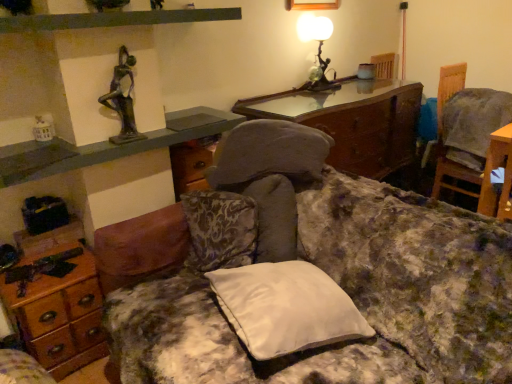
The height and width of the screenshot is (384, 512). I want to click on free location to the left of bronze statue at upper left, so click(x=91, y=139).